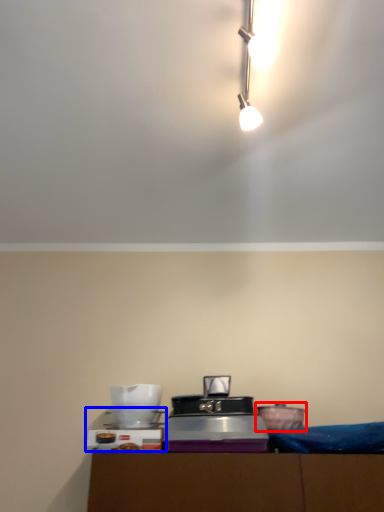
Question: Which point is further to the camera, appliance (highlighted by a red box) or appliance (highlighted by a blue box)?

Choices:
 (A) appliance
 (B) appliance

Answer: (A)